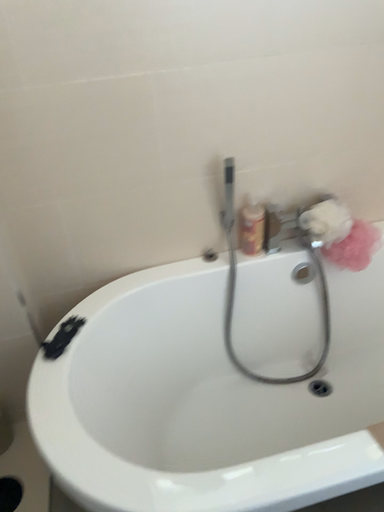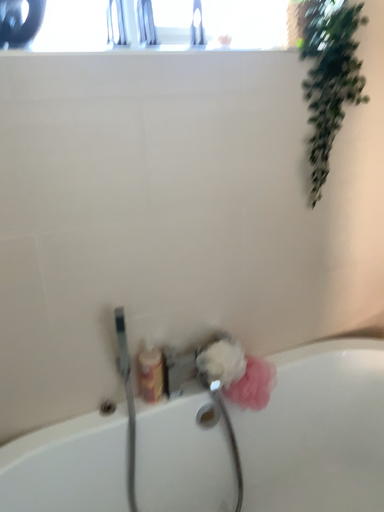
Question: How did the camera likely rotate when shooting the video?

Choices:
 (A) rotated downward
 (B) rotated upward

Answer: (B)